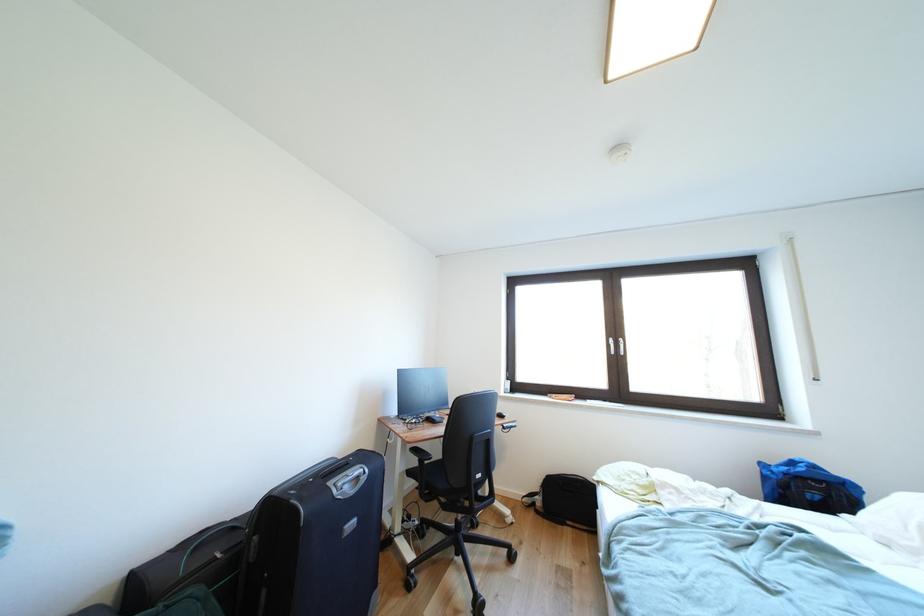
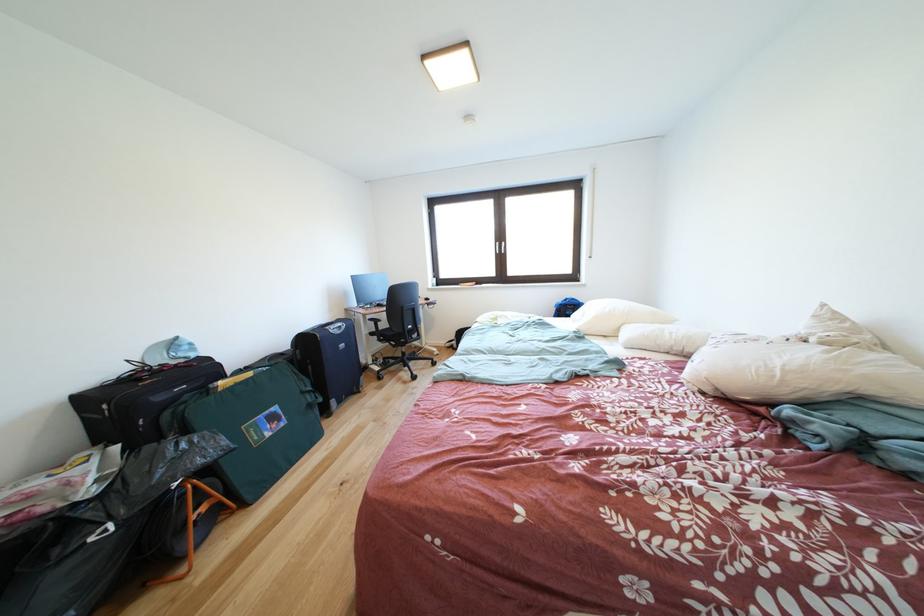
Find the pixel in the second image that matches pixel 360 496 in the first image.

(347, 337)